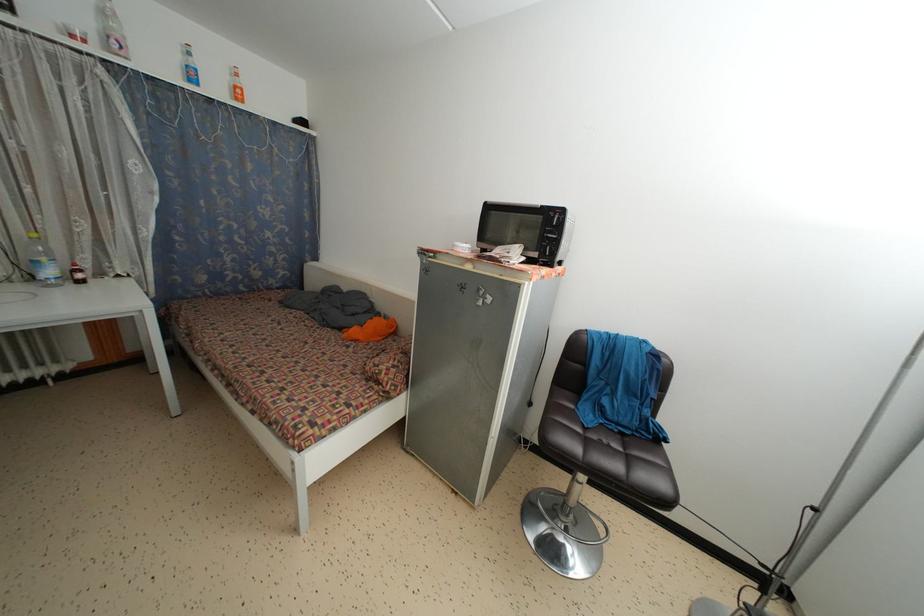
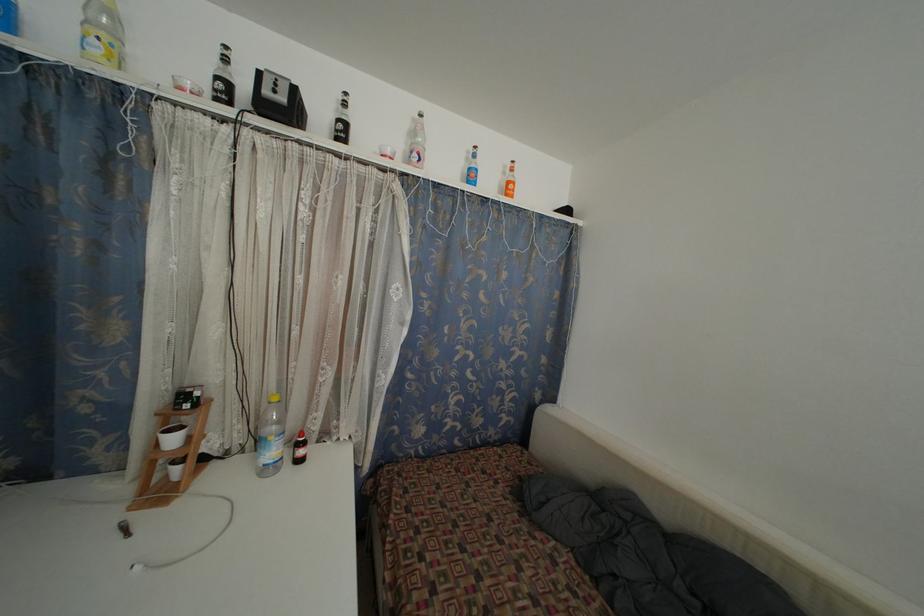
In the second image, find the point that corresponds to point (120, 41) in the first image.

(423, 154)